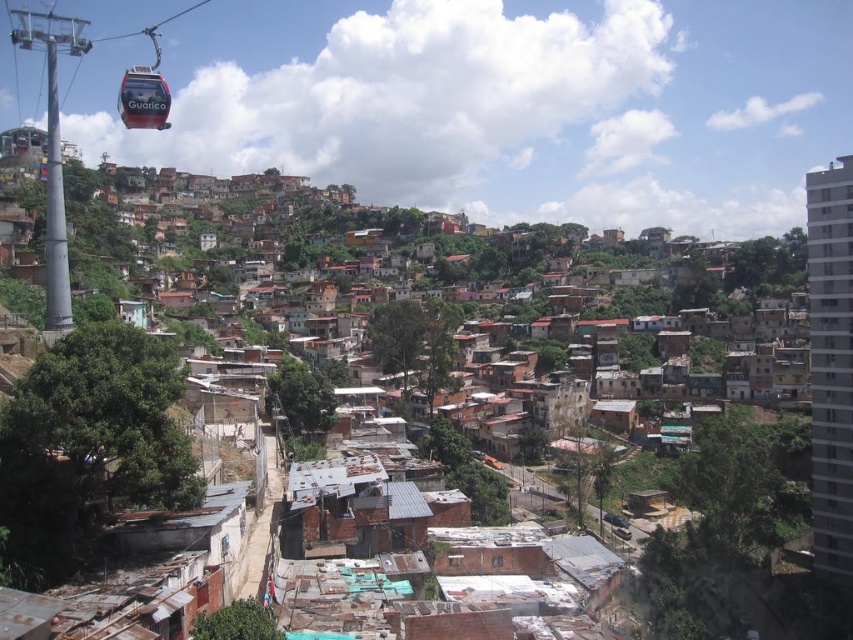
You are a drone operator tasked with capturing aerial footage of the brown corrugated metal rooftops at center and the red glossy cable car at upper left. Based on their heights, which object should you prioritize filming first if you want to capture both from the same altitude without adjusting your drone?

The brown corrugated metal rooftops at center has a greater height compared to the red glossy cable car at upper left. Therefore, you should prioritize filming the brown corrugated metal rooftops at center first to ensure both can be captured from the same altitude without adjusting the drone.

You are a photographer taking a picture of the urban area from this viewpoint. You want to focus on both point A at point (51, 385) and point B at point (167, 102). Which point is closer to your camera lens?

Point A at point (51, 385) is closer to the camera lens than point B at point (167, 102).